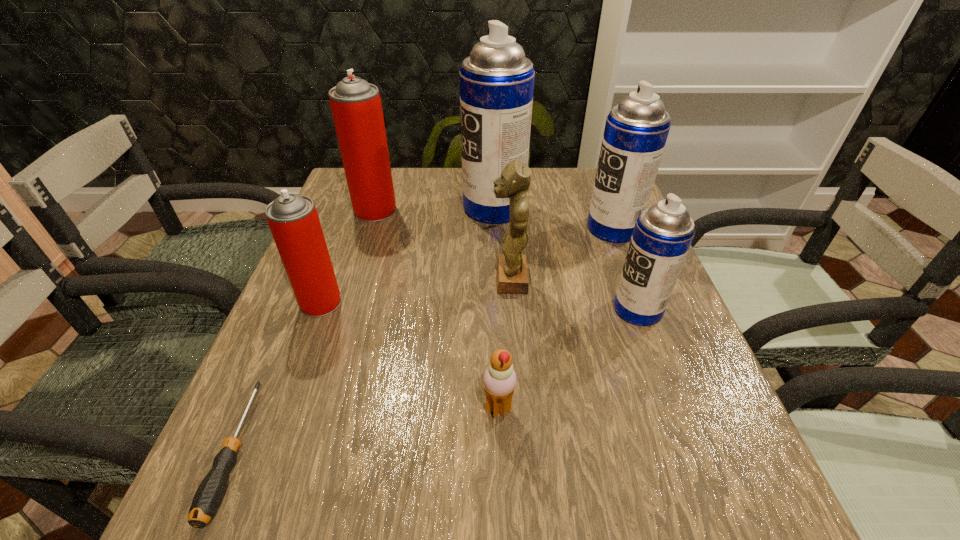
You are a GUI agent. You are given a task and a screenshot of the screen. Output one action in this format:
    pyautogui.click(x=<x>, y=<y>)
    Task: Click on the tallest aerosol can
    
    Given the screenshot: What is the action you would take?
    pyautogui.click(x=496, y=81)

In order to click on the leftmost blue aerosol can in this screenshot , I will do `click(496, 81)`.

Where is `the farther red aerosol can`? the farther red aerosol can is located at coordinates (356, 107).

The height and width of the screenshot is (540, 960). Find the location of `the second smallest blue aerosol can`. the second smallest blue aerosol can is located at coordinates (636, 130).

The width and height of the screenshot is (960, 540). Identify the location of figurine. (512, 275).

This screenshot has width=960, height=540. Find the location of `the smallest blue aerosol can`. the smallest blue aerosol can is located at coordinates (662, 235).

Find the location of a particular element. the smaller red aerosol can is located at coordinates (293, 220).

The width and height of the screenshot is (960, 540). I want to click on the second shortest object, so click(499, 380).

Find the location of a particular element. Image resolution: width=960 pixels, height=540 pixels. screwdriver is located at coordinates (209, 494).

Image resolution: width=960 pixels, height=540 pixels. Find the location of `vacant region located 0.340m on the label side of the tallest aerosol can`. vacant region located 0.340m on the label side of the tallest aerosol can is located at coordinates (338, 207).